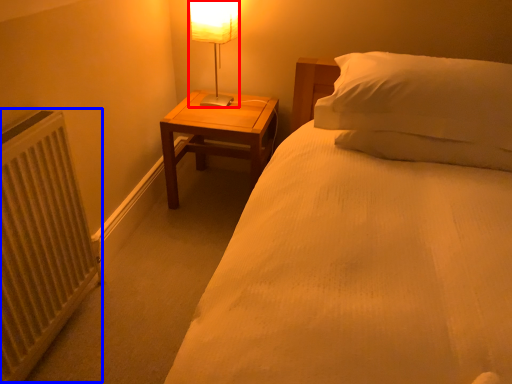
Question: Which object is closer to the camera taking this photo, table lamp (highlighted by a red box) or radiator (highlighted by a blue box)?

Choices:
 (A) table lamp
 (B) radiator

Answer: (B)